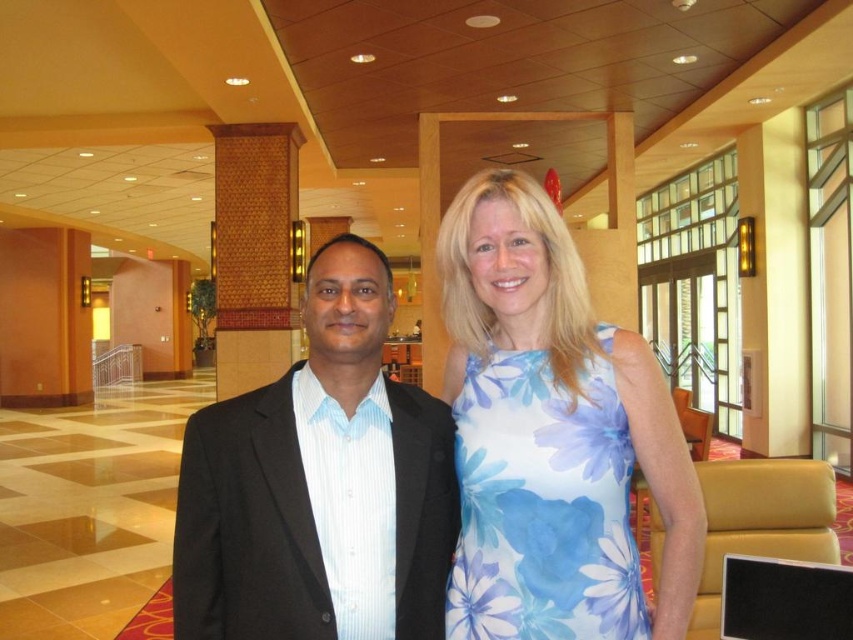
Does blue floral dress at center have a greater width compared to floral-patterned fabric dress at center?

Yes, blue floral dress at center is wider than floral-patterned fabric dress at center.

How far apart are blue floral dress at center and floral-patterned fabric dress at center?

The distance of blue floral dress at center from floral-patterned fabric dress at center is 1.37 inches.

The width and height of the screenshot is (853, 640). I want to click on blue floral dress at center, so click(x=552, y=435).

Who is taller, black matte suit at center or floral-patterned fabric dress at center?

black matte suit at center is taller.

At what (x,y) coordinates should I click in order to perform the action: click on black matte suit at center. Please return your answer as a coordinate pair (x, y). Looking at the image, I should click on (318, 484).

Which is behind, point (332, 349) or point (508, 371)?

The point (508, 371) is more distant.

The width and height of the screenshot is (853, 640). Identify the location of black matte suit at center. (318, 484).

Can you confirm if blue floral dress at center is positioned to the left of black matte suit at center?

No, blue floral dress at center is not to the left of black matte suit at center.

Who is shorter, blue floral dress at center or black matte suit at center?

black matte suit at center is shorter.

The width and height of the screenshot is (853, 640). Describe the element at coordinates (552, 435) in the screenshot. I see `blue floral dress at center` at that location.

The height and width of the screenshot is (640, 853). What are the coordinates of `blue floral dress at center` in the screenshot? It's located at (552, 435).